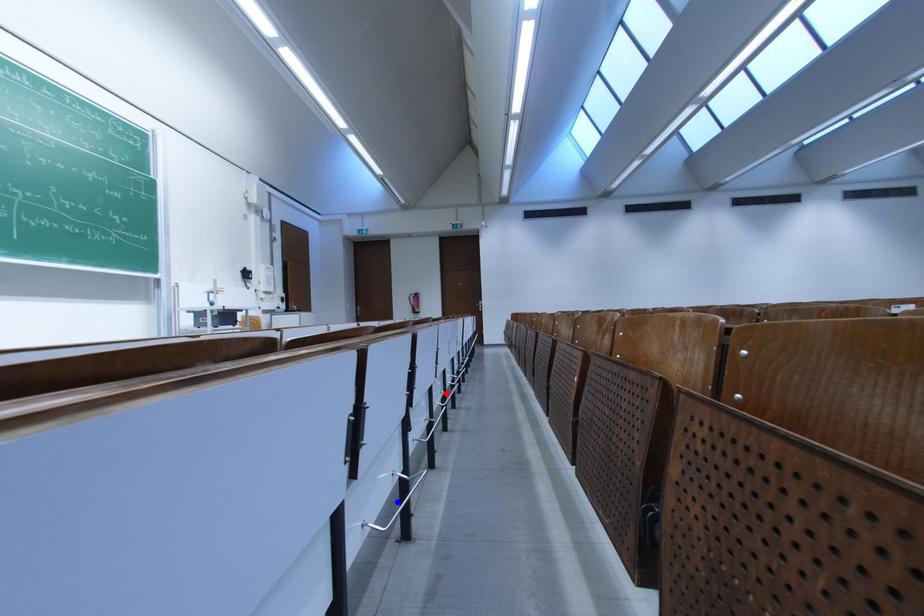
Question: In the image, two points are highlighted. Which point is nearer to the camera? Reply with the corresponding letter.

Choices:
 (A) blue point
 (B) red point

Answer: (A)